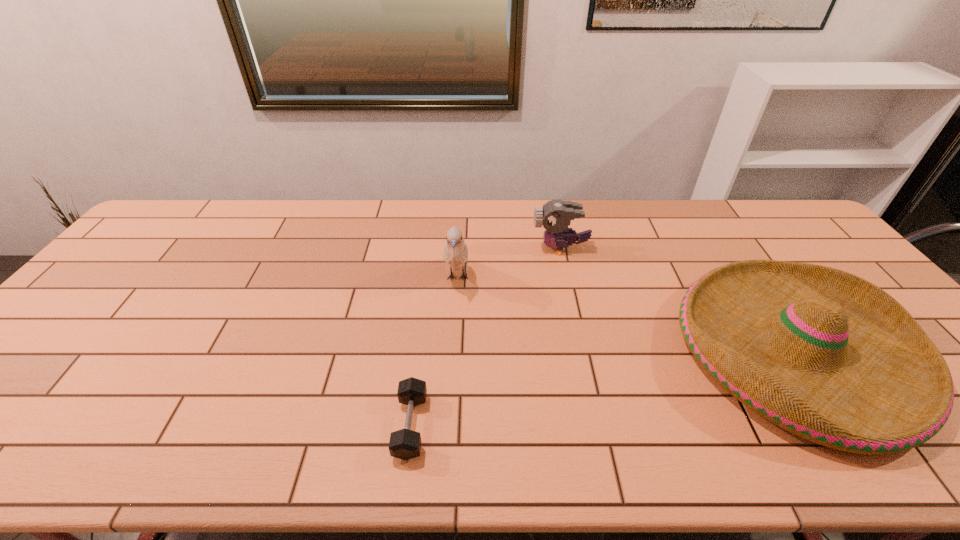
Locate an element on the screen. free spot between the left bird and the leftmost object is located at coordinates (434, 352).

At what (x,y) coordinates should I click in order to perform the action: click on the third closest object relative to the rightmost object. Please return your answer as a coordinate pair (x, y). Looking at the image, I should click on tap(405, 444).

Choose which object is the second nearest neighbor to the sombrero. Please provide its 2D coordinates. Your answer should be formatted as a tuple, i.e. [(x, y)], where the tuple contains the x and y coordinates of a point satisfying the conditions above.

[(455, 252)]

Identify the location of free space that satisfies the following two spatial constraints: 1. at the beak of the farther bird; 2. on the front side of the leftmost object. This screenshot has height=540, width=960. (599, 426).

Image resolution: width=960 pixels, height=540 pixels. I want to click on vacant area that satisfies the following two spatial constraints: 1. at the beak of the shorter bird; 2. at the beak of the left bird, so click(x=566, y=278).